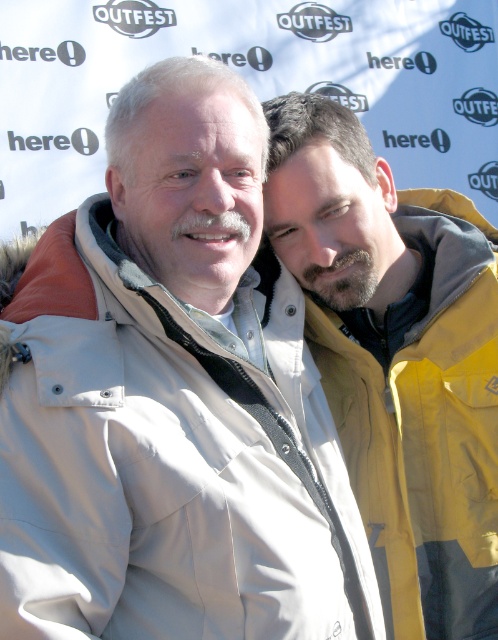
You are a photographer at the OUTFEST event and need to arrange two jackets for a promotional photo. The beige fabric jacket at center and the yellow fabric jacket at right must be positioned so that they align with the backdrop. According to the current arrangement, which jacket is lower in the image?

The beige fabric jacket at center is positioned below the yellow fabric jacket at right, so it is lower in the image.

Where is the beige fabric jacket at center located in the image?

The beige fabric jacket at center is located at point [169,458] in the image.

You are standing 5 meters away from the backdrop with the OUTFEST logo. There is a point at coordinates (x=101, y=486) in the image. Can you reach that point without moving closer than 4.92 meters to the backdrop?

The distance of point (x=101, y=486) from viewer is 4.92 meters. Since you are currently 5 meters away, you are slightly farther than the required distance. To reach the point without moving closer than 4.92 meters, you would need to extend your reach or use a tool, but physically touching it while staying at 5 meters or farther may not be possible.